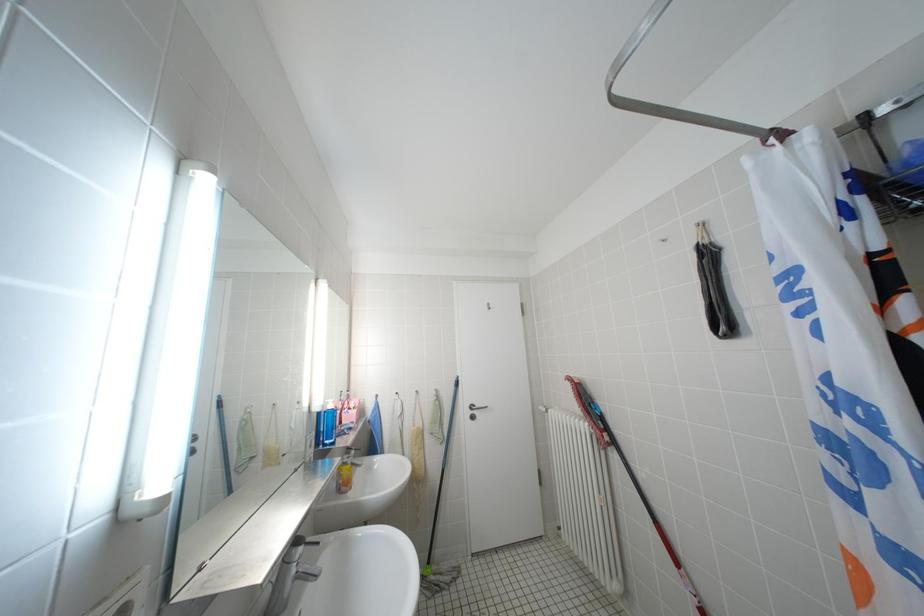
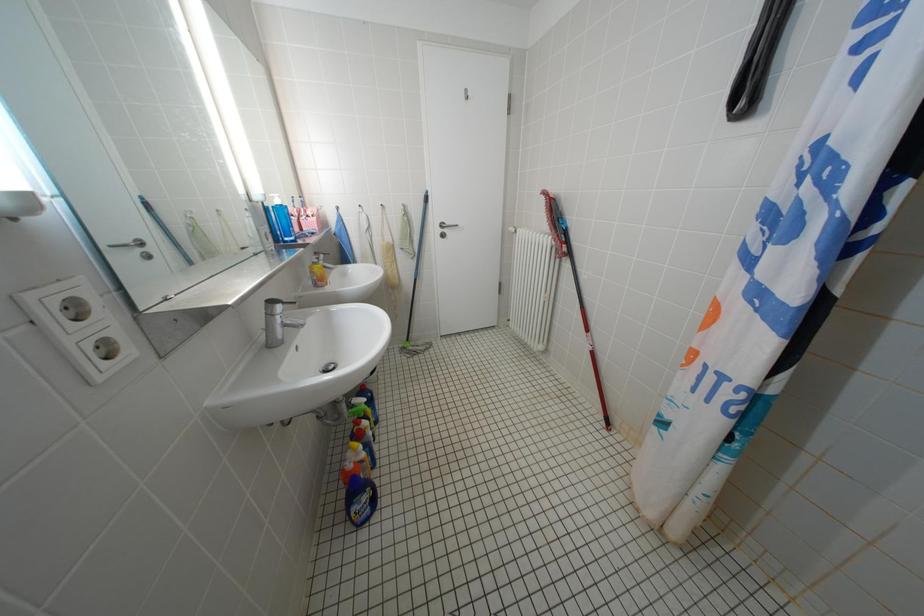
Question: The first image is from the beginning of the video and the second image is from the end. How did the camera likely rotate when shooting the video?

Choices:
 (A) Left
 (B) Right
 (C) Up
 (D) Down

Answer: (D)